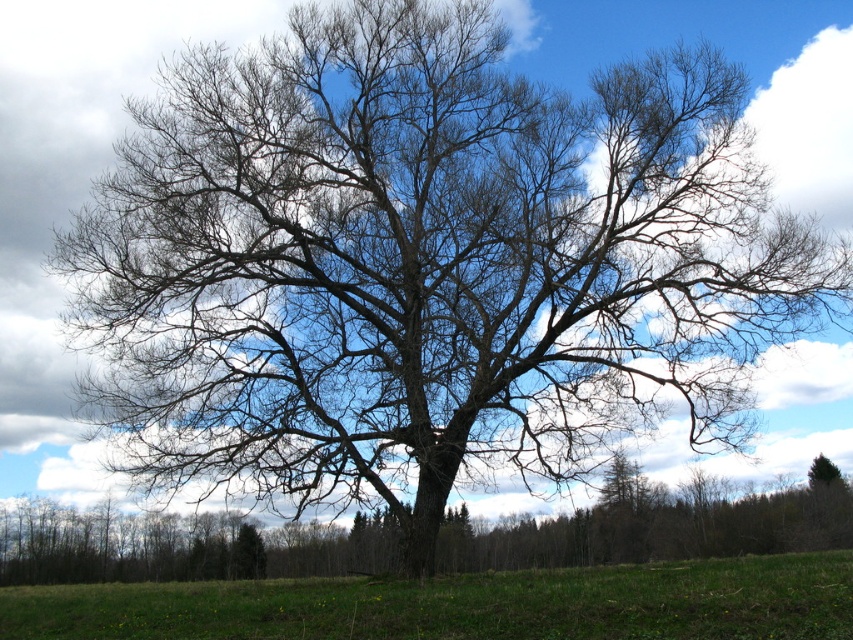
Question: Observing the image, what is the correct spatial positioning of green grassy field at center in reference to bare wood tree at center?

Choices:
 (A) right
 (B) left

Answer: (B)

Question: Which of the following is the closest to the observer?

Choices:
 (A) [392, 620]
 (B) [732, 520]

Answer: (A)

Question: Among these objects, which one is farthest from the camera?

Choices:
 (A) bare wood tree at center
 (B) green grassy field at center

Answer: (A)

Question: Among these points, which one is farthest from the camera?

Choices:
 (A) (291, 554)
 (B) (102, 628)

Answer: (A)

Question: Observing the image, what is the correct spatial positioning of green grassy field at center in reference to bare wood tree at center?

Choices:
 (A) left
 (B) right

Answer: (A)

Question: Can you confirm if green grassy field at center is thinner than bare wood tree at center?

Choices:
 (A) yes
 (B) no

Answer: (A)